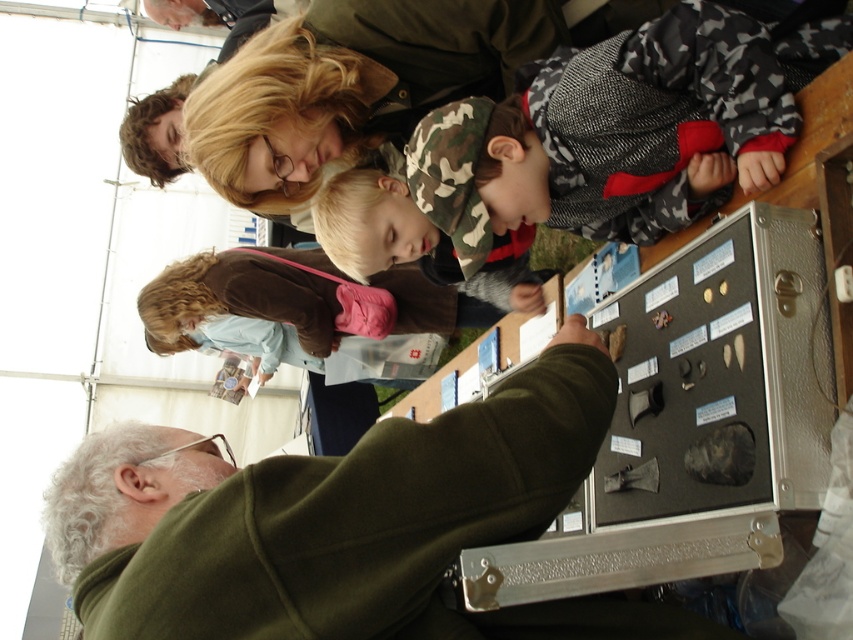
Question: Which of the following is the farthest from the observer?

Choices:
 (A) (115, 637)
 (B) (337, 296)

Answer: (B)

Question: Where is green matte jacket at center located in relation to brown suede purse at upper left in the image?

Choices:
 (A) left
 (B) right

Answer: (B)

Question: Does green matte jacket at center appear on the right side of brown suede purse at upper left?

Choices:
 (A) yes
 (B) no

Answer: (A)

Question: Can you confirm if green matte jacket at center is thinner than brown suede purse at upper left?

Choices:
 (A) yes
 (B) no

Answer: (A)

Question: Which point is closer to the camera?

Choices:
 (A) green matte jacket at center
 (B) brown suede purse at upper left

Answer: (A)